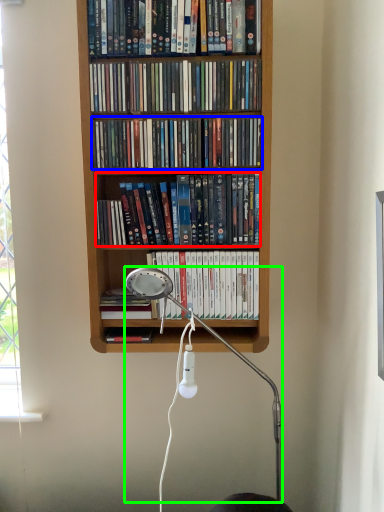
Question: Which is farther away from book (highlighted by a red box)? book (highlighted by a blue box) or lamp (highlighted by a green box)?

Choices:
 (A) book
 (B) lamp

Answer: (B)